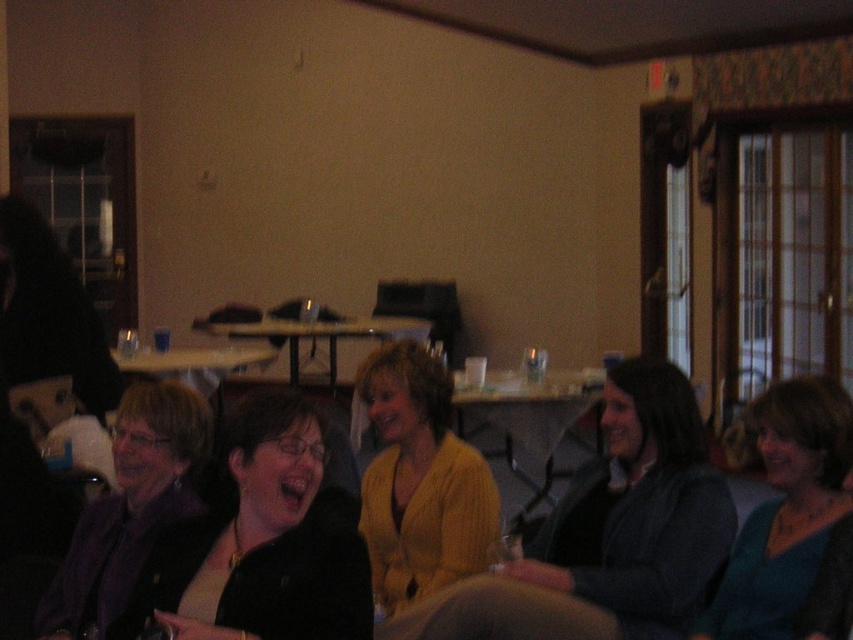
You are standing in the room and want to reach both the point at coordinates (x=178, y=529) and the point at coordinates (x=288, y=356). Which point will you reach first?

You will reach point (x=178, y=529) first because it is closer to you than point (x=288, y=356).

You are a guest at this gathering and want to place your black matte glasses at center on the wooden table at center. Can you do so without moving any other items on the table?

The black matte glasses at center is already located below the wooden table at center, so you can place them there without moving other items.

You are a photographer who wants to take a clear picture of the black matte glasses at center. The camera you are using has a minimum focusing distance of 5 feet. Can you take a clear photo without moving the camera or the glasses?

The black matte glasses at center and camera are 6.09 feet apart from each other. Since the minimum focusing distance is 5 feet, the photographer can take a clear photo as the distance is sufficient.